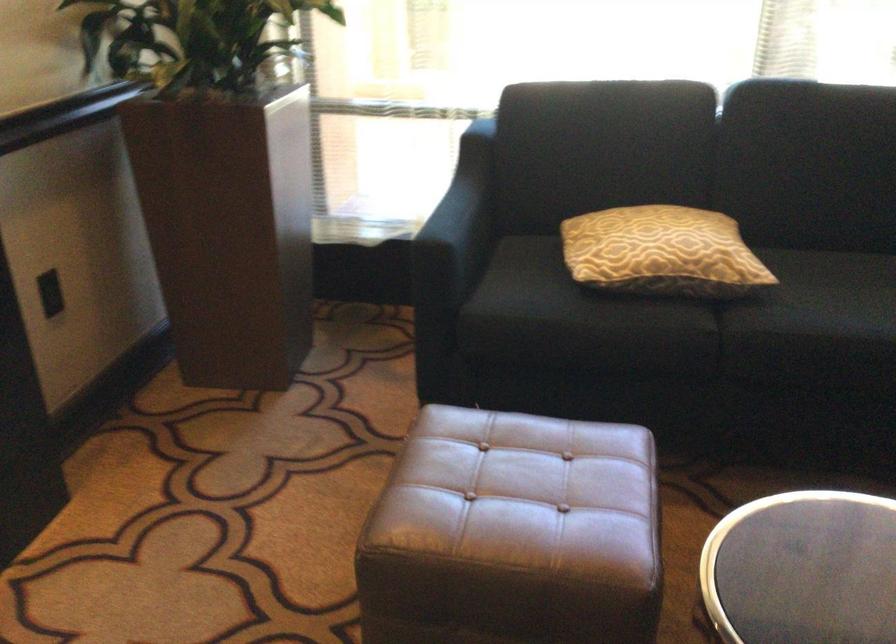
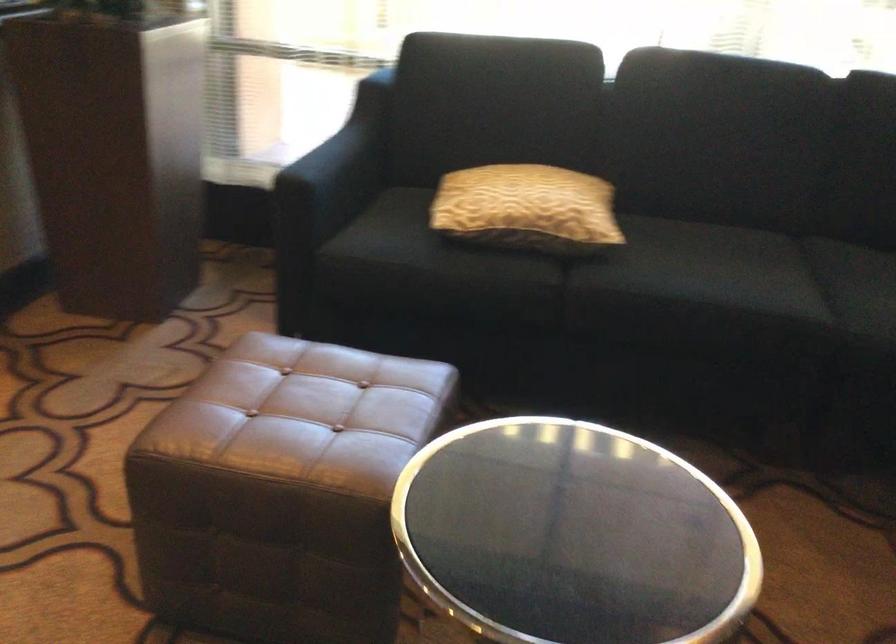
Question: The camera is either moving clockwise (left) or counter-clockwise (right) around the object. The first image is from the beginning of the video and the second image is from the end. Is the camera moving left or right when shooting the video?

Choices:
 (A) Left
 (B) Right

Answer: (A)